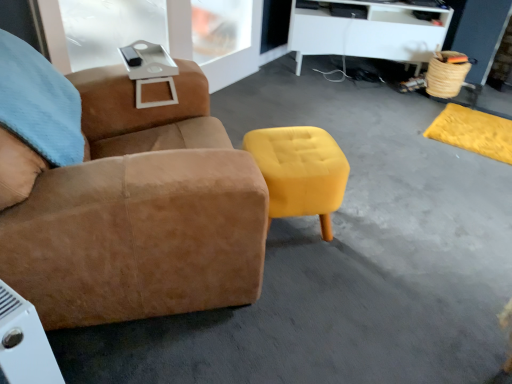
This screenshot has height=384, width=512. In order to click on free point above yellow suede ottoman at center (from a real-world perspective) in this screenshot , I will do `click(293, 153)`.